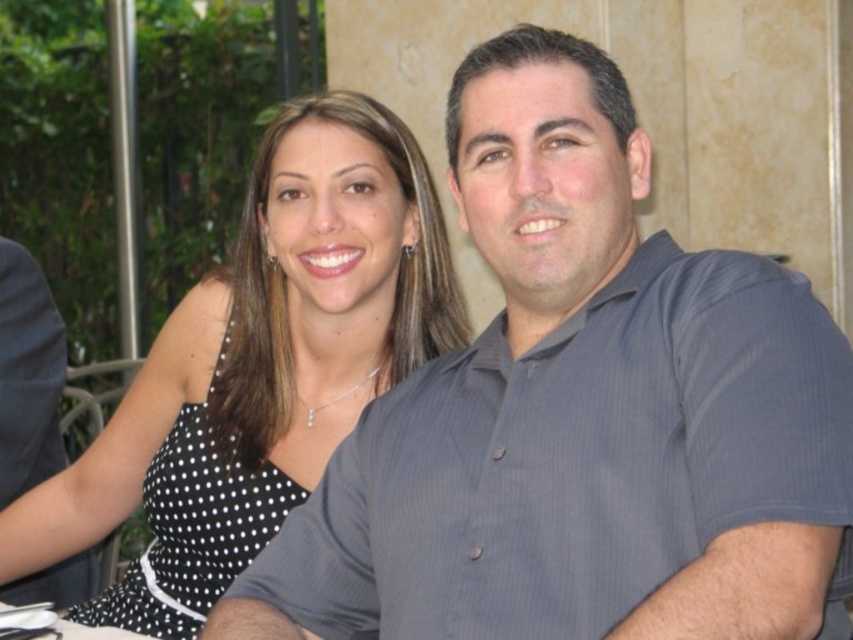
Who is lower down, gray striped shirt at center or black dotted dress at center?

black dotted dress at center

This screenshot has height=640, width=853. Describe the element at coordinates (581, 413) in the screenshot. I see `gray striped shirt at center` at that location.

What do you see at coordinates (581, 413) in the screenshot? The image size is (853, 640). I see `gray striped shirt at center` at bounding box center [581, 413].

The height and width of the screenshot is (640, 853). Identify the location of gray striped shirt at center. (581, 413).